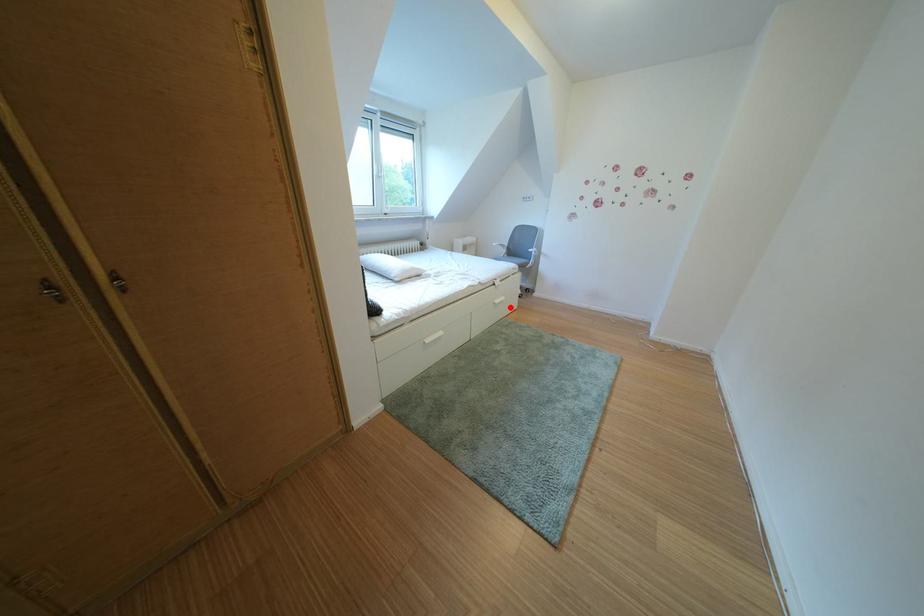
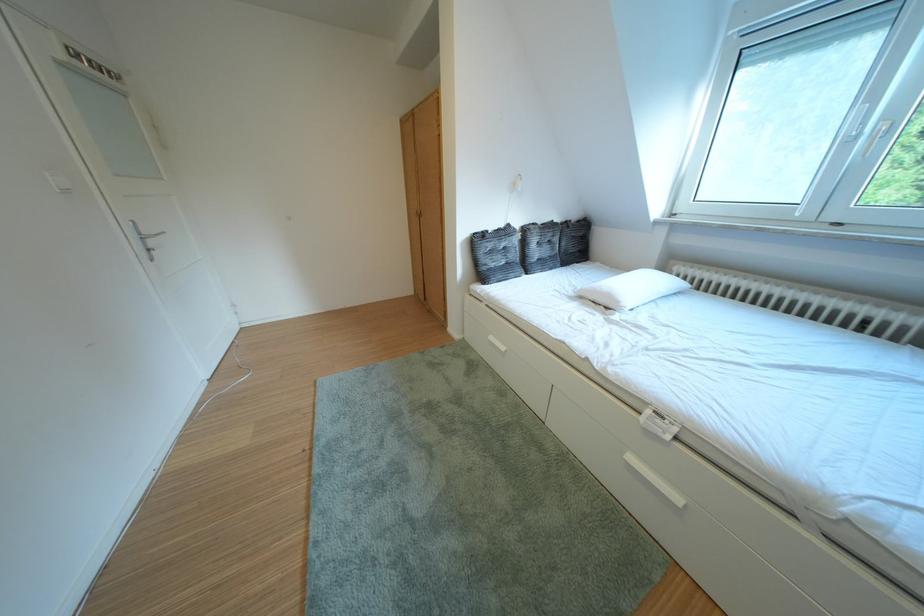
In the second image, find the point that corresponds to the highlighted location in the first image.

(646, 464)